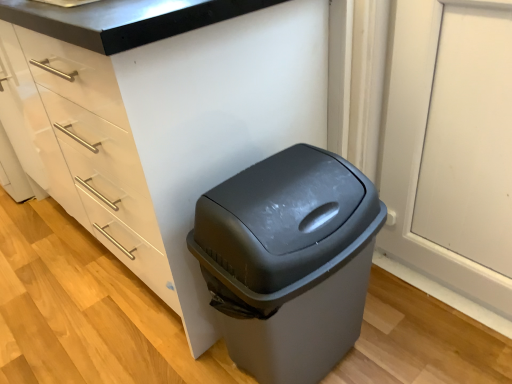
This screenshot has height=384, width=512. I want to click on vacant area that is situated to the right of gray plastic trash can at center, so click(x=414, y=337).